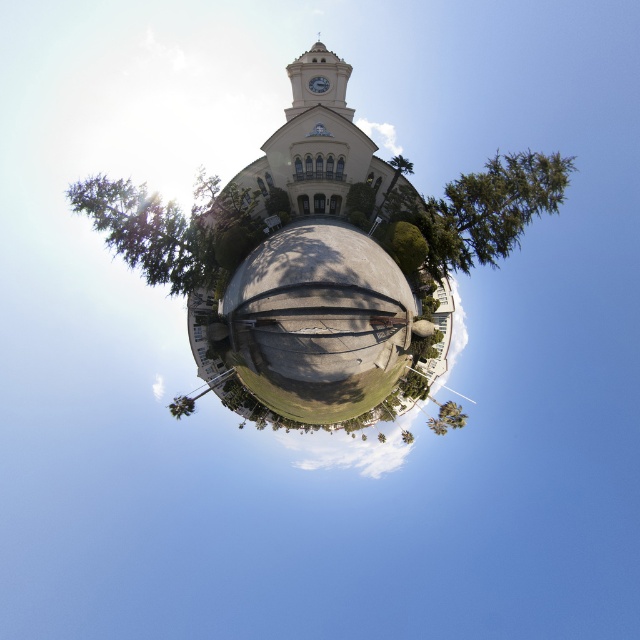
Question: Can you confirm if beige stone church at center is thinner than green leafy tree at lower center?

Choices:
 (A) yes
 (B) no

Answer: (B)

Question: Which object is the closest to the green textured tree at upper center?

Choices:
 (A) green leafy tree at upper center
 (B) green leafy tree at center

Answer: (B)

Question: Is green leafy tree at lower left behind green leafy tree at center?

Choices:
 (A) no
 (B) yes

Answer: (B)

Question: Which object appears farthest from the camera in this image?

Choices:
 (A) green leafy tree at lower left
 (B) green leafy tree at center
 (C) green leafy tree at upper center
 (D) green textured tree at upper center

Answer: (A)

Question: Does green leafy tree at lower center appear under green leafy tree at center?

Choices:
 (A) no
 (B) yes

Answer: (A)

Question: Which point is farther from the camera taking this photo?

Choices:
 (A) (516, 196)
 (B) (294, 292)
 (C) (403, 432)
 (D) (161, 269)

Answer: (A)